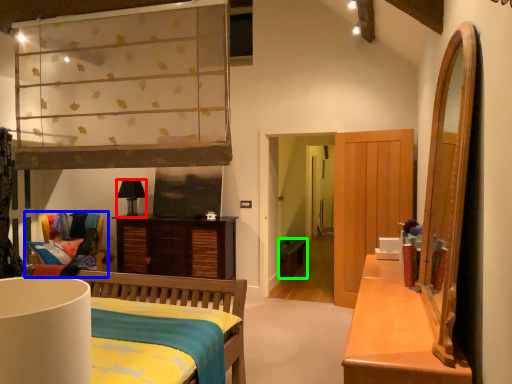
Question: Based on their relative distances, which object is nearer to lamp (highlighted by a red box)? Choose from chair (highlighted by a blue box) and studio couch (highlighted by a green box).

Choices:
 (A) chair
 (B) studio couch

Answer: (A)